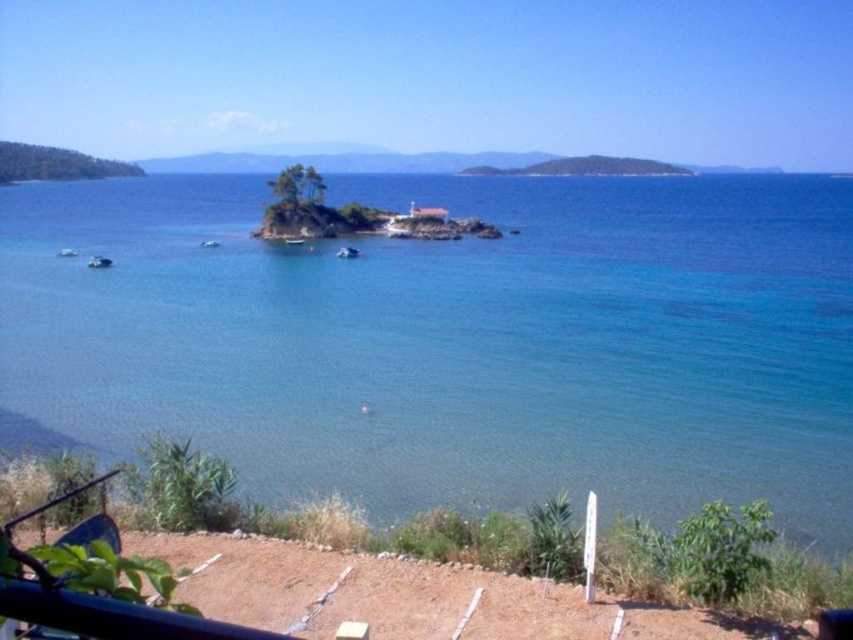
Question: Can you confirm if clear blue water at center is thinner than white plastic boat at lower left?

Choices:
 (A) yes
 (B) no

Answer: (B)

Question: Among these objects, which one is nearest to the camera?

Choices:
 (A) white glossy boat at center
 (B) white plastic boat at lower left

Answer: (A)

Question: Which of these objects is positioned farthest from the clear blue water at center?

Choices:
 (A) white plastic boat at lower left
 (B) metallic blue boat at left

Answer: (A)

Question: Does metallic blue boat at left lie in front of white plastic boat at lower left?

Choices:
 (A) yes
 (B) no

Answer: (A)

Question: Which object appears closest to the camera in this image?

Choices:
 (A) clear blue water at center
 (B) white plastic boat at lower left

Answer: (A)

Question: Is clear blue water at center above metallic blue boat at left?

Choices:
 (A) yes
 (B) no

Answer: (A)